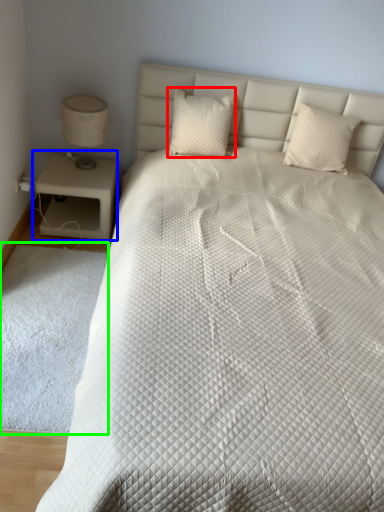
Question: Considering the real-world distances, which object is closest to pillow (highlighted by a red box)? nightstand (highlighted by a blue box) or mat (highlighted by a green box).

Choices:
 (A) nightstand
 (B) mat

Answer: (A)